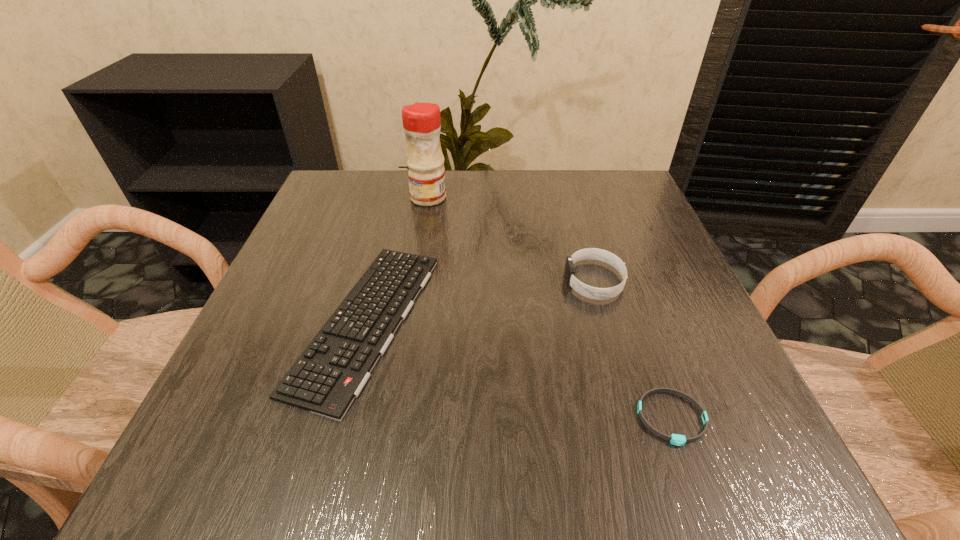
Locate which object ranks second in proximity to the farther wristband. Please provide its 2D coordinates. Your answer should be formatted as a tuple, i.e. [(x, y)], where the tuple contains the x and y coordinates of a point satisfying the conditions above.

[(331, 372)]

Identify which object is located as the third nearest to the second shortest object. Please provide its 2D coordinates. Your answer should be formatted as a tuple, i.e. [(x, y)], where the tuple contains the x and y coordinates of a point satisfying the conditions above.

[(679, 440)]

At what (x,y) coordinates should I click in order to perform the action: click on free location that satisfies the following two spatial constraints: 1. on the back side of the computer keyboard; 2. on the right side of the farthest object. Please return your answer as a coordinate pair (x, y). Looking at the image, I should click on (398, 198).